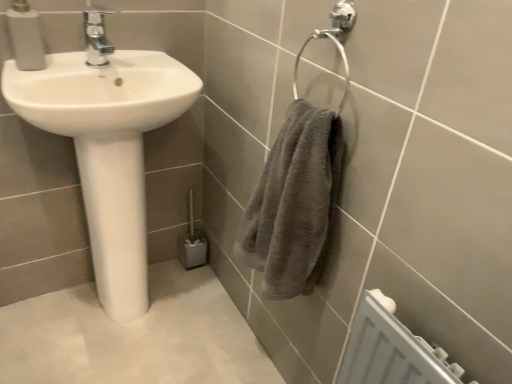
Image resolution: width=512 pixels, height=384 pixels. I want to click on vacant area to the right of matte white soap dispenser at upper left, so click(x=90, y=62).